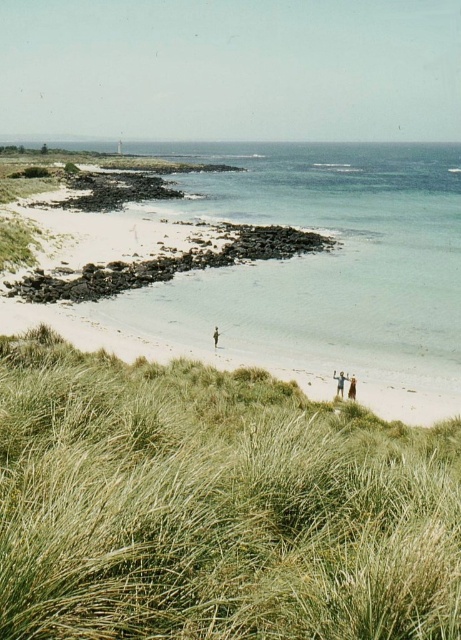
Which is more to the right, brown textured fabric at lower center or light brown wooden stick at lower right?

brown textured fabric at lower center

Which is behind, point (348, 376) or point (341, 374)?

Positioned behind is point (348, 376).

This screenshot has width=461, height=640. I want to click on brown textured fabric at lower center, so click(x=343, y=385).

Does green grassy at lower left come in front of light brown hair at lower right?

Yes, it is in front of light brown hair at lower right.

Does green grassy at lower left appear under light brown hair at lower right?

Incorrect, green grassy at lower left is not positioned below light brown hair at lower right.

The width and height of the screenshot is (461, 640). What are the coordinates of `green grassy at lower left` in the screenshot? It's located at (214, 506).

At what (x,y) coordinates should I click in order to perform the action: click on green grassy at lower left. Please return your answer as a coordinate pair (x, y). The height and width of the screenshot is (640, 461). Looking at the image, I should click on (214, 506).

Can you confirm if brown textured fabric at lower center is taller than light brown hair at lower right?

Correct, brown textured fabric at lower center is much taller as light brown hair at lower right.

The width and height of the screenshot is (461, 640). What do you see at coordinates (343, 385) in the screenshot? I see `brown textured fabric at lower center` at bounding box center [343, 385].

This screenshot has height=640, width=461. In order to click on brown textured fabric at lower center in this screenshot , I will do coord(343,385).

Where is `brown textured fabric at lower center`? brown textured fabric at lower center is located at coordinates (343, 385).